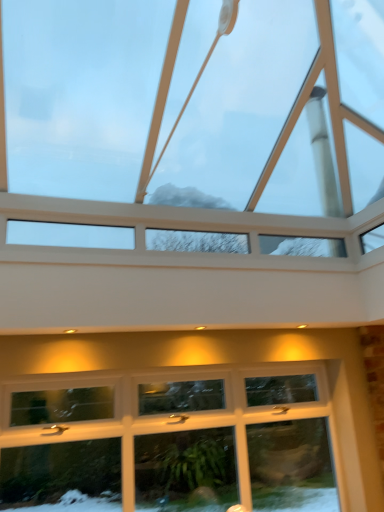
The width and height of the screenshot is (384, 512). I want to click on transparent glass window at upper center, so click(283, 114).

What do you see at coordinates (283, 114) in the screenshot? I see `transparent glass window at upper center` at bounding box center [283, 114].

What are the coordinates of `transparent glass window at upper center` in the screenshot? It's located at (283, 114).